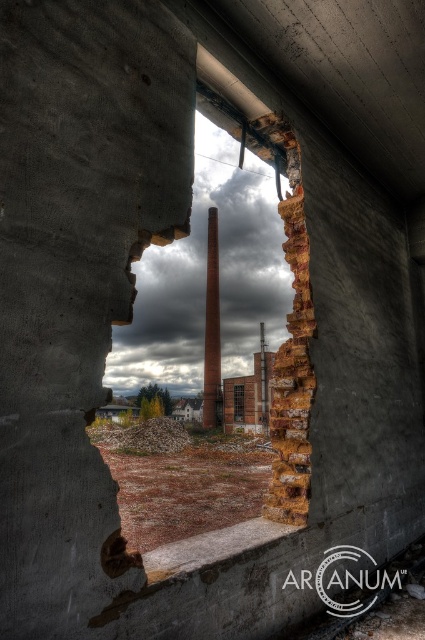
You are an inspector checking the structural integrity of the building. You notice the smooth concrete pillar at center and the transparent glass window at center. Based on their positions, which one is more to the left?

The smooth concrete pillar at center is positioned on the left side of transparent glass window at center, so it is more to the left.

You are a construction inspector assessing the structural integrity of the building. You notice the rusty metal hole at center and the smooth concrete pillar at center. Which object is shorter in height?

The rusty metal hole at center is not as tall as the smooth concrete pillar at center, so the rusty metal hole at center is shorter in height.